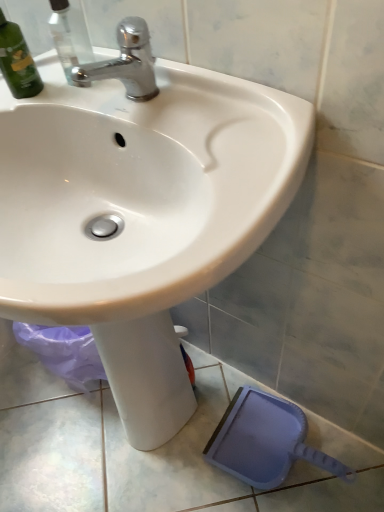
Question: From the image's perspective, is white glossy sink at upper center under green matte bottle at upper left?

Choices:
 (A) no
 (B) yes

Answer: (B)

Question: Is the position of white glossy sink at upper center more distant than that of green matte bottle at upper left?

Choices:
 (A) yes
 (B) no

Answer: (B)

Question: Is green matte bottle at upper left inside white glossy sink at upper center?

Choices:
 (A) no
 (B) yes

Answer: (A)

Question: Can you confirm if white glossy sink at upper center is smaller than green matte bottle at upper left?

Choices:
 (A) yes
 (B) no

Answer: (B)

Question: From a real-world perspective, is white glossy sink at upper center physically below green matte bottle at upper left?

Choices:
 (A) no
 (B) yes

Answer: (B)

Question: Is white glossy sink at upper center aimed at green matte bottle at upper left?

Choices:
 (A) yes
 (B) no

Answer: (B)

Question: Is chrome metallic faucet at upper center far from white glossy sink at upper center?

Choices:
 (A) no
 (B) yes

Answer: (A)

Question: From the image's perspective, would you say chrome metallic faucet at upper center is shown under white glossy sink at upper center?

Choices:
 (A) no
 (B) yes

Answer: (A)

Question: From a real-world perspective, does chrome metallic faucet at upper center sit lower than white glossy sink at upper center?

Choices:
 (A) no
 (B) yes

Answer: (A)

Question: Does chrome metallic faucet at upper center have a greater height compared to white glossy sink at upper center?

Choices:
 (A) yes
 (B) no

Answer: (B)

Question: Is chrome metallic faucet at upper center thinner than white glossy sink at upper center?

Choices:
 (A) no
 (B) yes

Answer: (B)

Question: Is chrome metallic faucet at upper center closer to camera compared to white glossy sink at upper center?

Choices:
 (A) no
 (B) yes

Answer: (A)

Question: Can you see green matte bottle at upper left touching chrome metallic faucet at upper center?

Choices:
 (A) no
 (B) yes

Answer: (A)